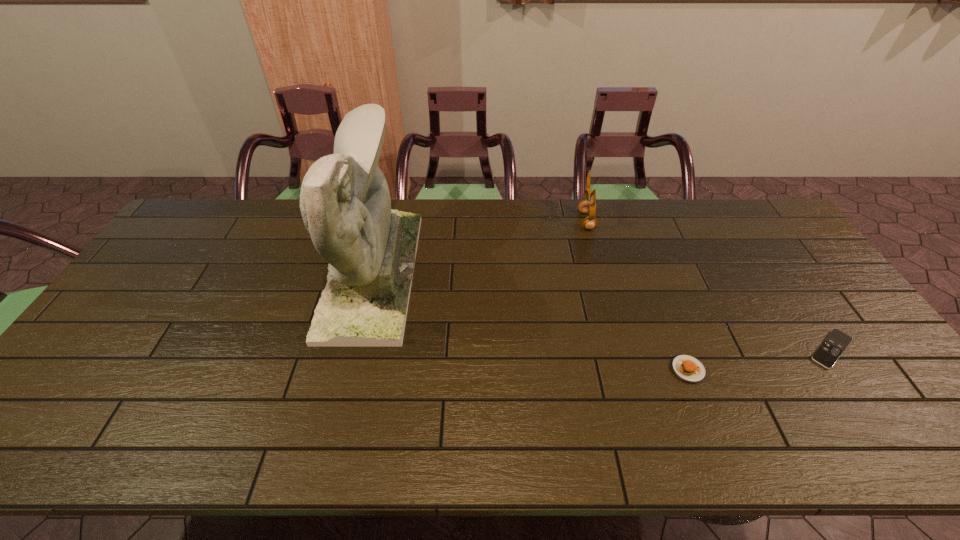
Image resolution: width=960 pixels, height=540 pixels. In the image, there is a desktop. In order to click on free region at the near left corner in this screenshot , I will do `click(82, 437)`.

You are a GUI agent. You are given a task and a screenshot of the screen. Output one action in this format:
    pyautogui.click(x=<x>, y=<y>)
    Task: Click on the vacant area at the far right corner of the desktop
    This screenshot has height=540, width=960.
    Given the screenshot: What is the action you would take?
    pyautogui.click(x=767, y=217)

Locate an element on the screen. Image resolution: width=960 pixels, height=540 pixels. vacant space at the near right corner is located at coordinates tap(885, 431).

You are a GUI agent. You are given a task and a screenshot of the screen. Output one action in this format:
    pyautogui.click(x=<x>, y=<y>)
    Task: Click on the vacant area that lies between the second tallest object and the shortest object
    Image resolution: width=960 pixels, height=540 pixels.
    Given the screenshot: What is the action you would take?
    pyautogui.click(x=708, y=285)

Identify the location of free spot between the shortest object and the leftmost object. This screenshot has width=960, height=540. (602, 312).

At what (x,y) coordinates should I click in order to perform the action: click on free space between the rightmost object and the sculpture. Please return your answer as a coordinate pair (x, y). Looking at the image, I should click on (602, 312).

Image resolution: width=960 pixels, height=540 pixels. Identify the location of free point between the tallest object and the shortest object. coord(602,312).

The height and width of the screenshot is (540, 960). Identify the location of vacant space that's between the food and the sculpture. (530, 321).

Image resolution: width=960 pixels, height=540 pixels. I want to click on free space that is in between the tallest object and the earphone, so click(479, 247).

Locate an element on the screen. free space between the rightmost object and the leftmost object is located at coordinates (602, 312).